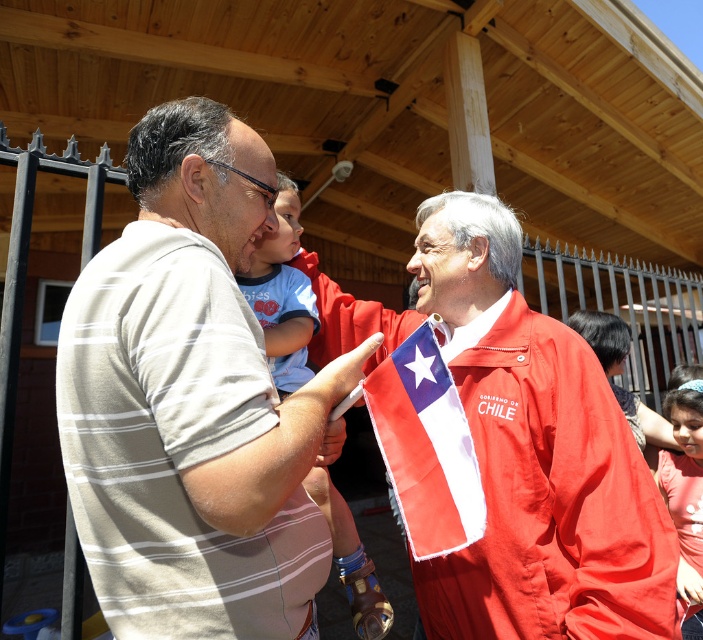
Question: Is red matte jacket at center to the right of matte pink shirt at lower right from the viewer's perspective?

Choices:
 (A) yes
 (B) no

Answer: (B)

Question: Does red fabric flag at center appear on the left side of light blue cotton shirt at upper center?

Choices:
 (A) yes
 (B) no

Answer: (B)

Question: Considering the real-world distances, which object is farthest from the light blue cotton shirt at upper center?

Choices:
 (A) matte pink shirt at lower right
 (B) red matte jacket at center

Answer: (A)

Question: Where is red fabric flag at center located in relation to light blue cotton shirt at upper center in the image?

Choices:
 (A) left
 (B) right

Answer: (B)

Question: Estimate the real-world distances between objects in this image. Which object is farther from the red matte jacket at center?

Choices:
 (A) matte pink shirt at lower right
 (B) red fabric flag at center
 (C) light blue cotton shirt at upper center
 (D) striped cotton shirt at left

Answer: (A)

Question: Among these points, which one is nearest to the camera?

Choices:
 (A) (221, 390)
 (B) (445, 403)

Answer: (A)